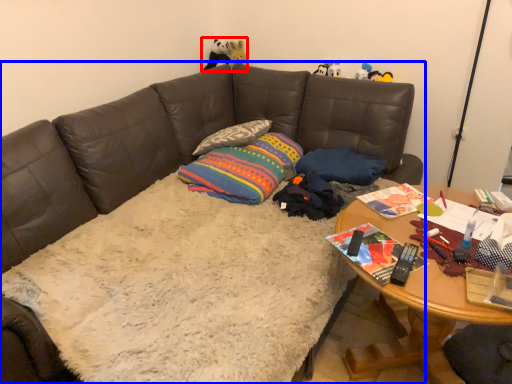
Question: Which object appears closest to the camera in this image, toy (highlighted by a red box) or studio couch (highlighted by a blue box)?

Choices:
 (A) toy
 (B) studio couch

Answer: (B)